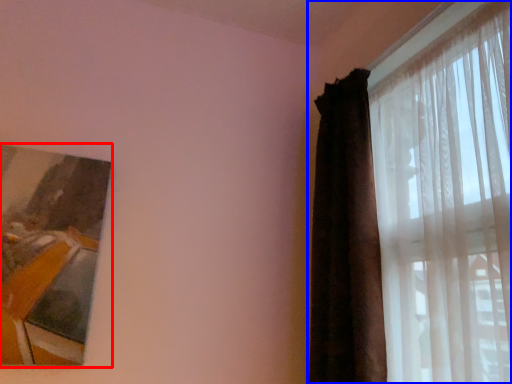
Question: Among these objects, which one is nearest to the camera, picture frame (highlighted by a red box) or curtain (highlighted by a blue box)?

Choices:
 (A) picture frame
 (B) curtain

Answer: (B)